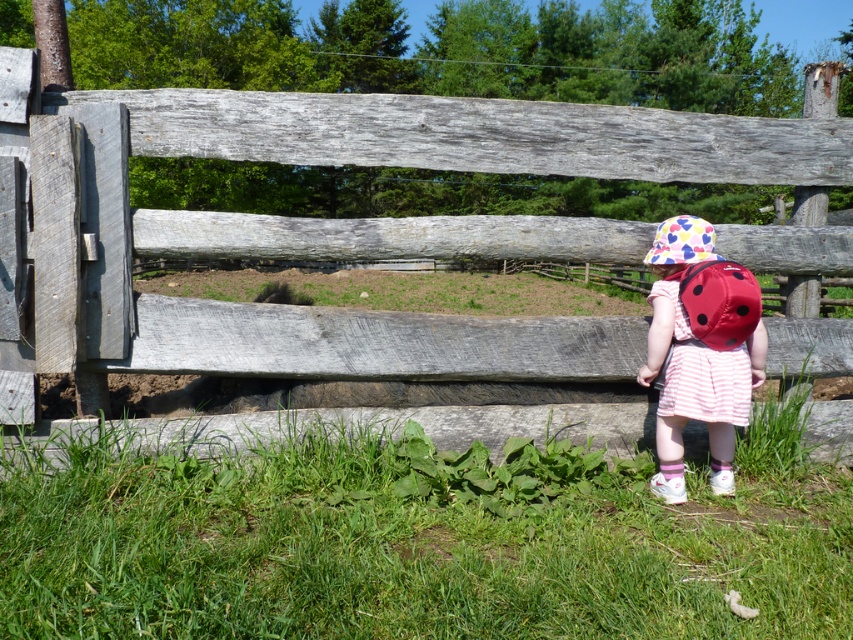
Does polka dot fabric hat at center appear under multicolored fabric hat at center?

Indeed, polka dot fabric hat at center is positioned under multicolored fabric hat at center.

Does point (656, 480) come behind point (700, 232)?

Yes, point (656, 480) is behind point (700, 232).

Find the location of a particular element. Image resolution: width=853 pixels, height=640 pixels. polka dot fabric hat at center is located at coordinates [694, 364].

Is green grass at lower center positioned in front of weathered wood fence at center?

Yes, green grass at lower center is in front of weathered wood fence at center.

Can you confirm if green grass at lower center is shorter than weathered wood fence at center?

Correct, green grass at lower center is not as tall as weathered wood fence at center.

Locate an element on the screen. This screenshot has width=853, height=640. green grass at lower center is located at coordinates (422, 541).

Measure the distance between weathered wood fence at center and camera.

15.61 feet

Which is in front, point (18, 365) or point (727, 285)?

Point (727, 285)

Is point (161, 339) closer to viewer compared to point (753, 310)?

No, (161, 339) is behind (753, 310).

The image size is (853, 640). I want to click on weathered wood fence at center, so click(x=479, y=134).